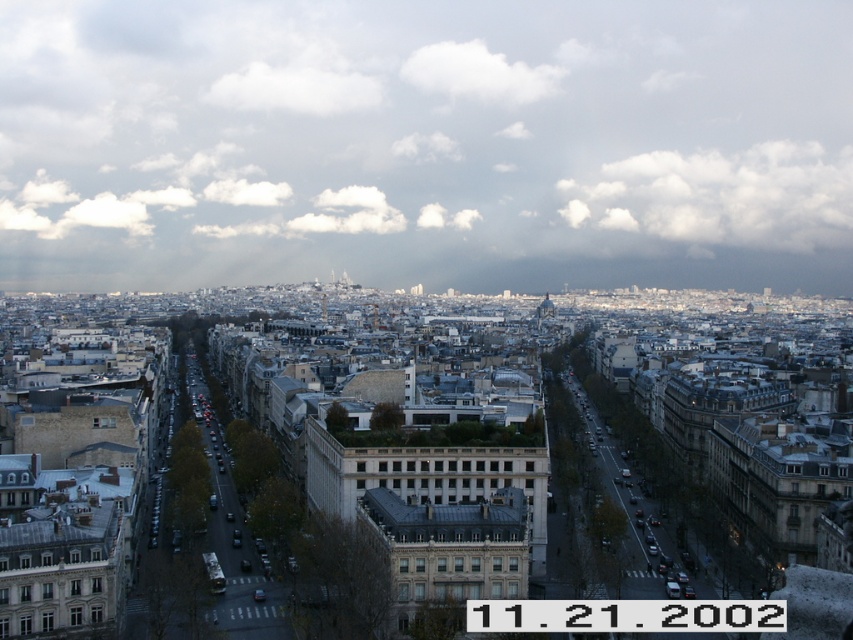
Is point (664, 234) positioned in front of point (508, 88)?

No, it is not.

Does white fluffy cloud at upper right appear under white fluffy cloud at upper center?

Correct, white fluffy cloud at upper right is located below white fluffy cloud at upper center.

This screenshot has width=853, height=640. What do you see at coordinates (722, 196) in the screenshot?
I see `white fluffy cloud at upper right` at bounding box center [722, 196].

Image resolution: width=853 pixels, height=640 pixels. I want to click on white fluffy cloud at upper right, so click(722, 196).

Is white fluffy clouds at upper center closer to the viewer compared to white fluffy cloud at upper right?

Yes, it is in front of white fluffy cloud at upper right.

Measure the distance between point [399,138] and camera.

626.37 meters

Is point (425, 161) farther from viewer compared to point (721, 164)?

No, (425, 161) is in front of (721, 164).

Find the location of a particular element. The height and width of the screenshot is (640, 853). white fluffy clouds at upper center is located at coordinates (425, 144).

Does white fluffy clouds at upper center have a larger size compared to white fluffy cloud at upper center?

Yes, white fluffy clouds at upper center is bigger than white fluffy cloud at upper center.

Which is more to the left, white fluffy clouds at upper center or white fluffy cloud at upper center?

From the viewer's perspective, white fluffy clouds at upper center appears more on the left side.

This screenshot has height=640, width=853. Find the location of `white fluffy clouds at upper center`. white fluffy clouds at upper center is located at coordinates pos(425,144).